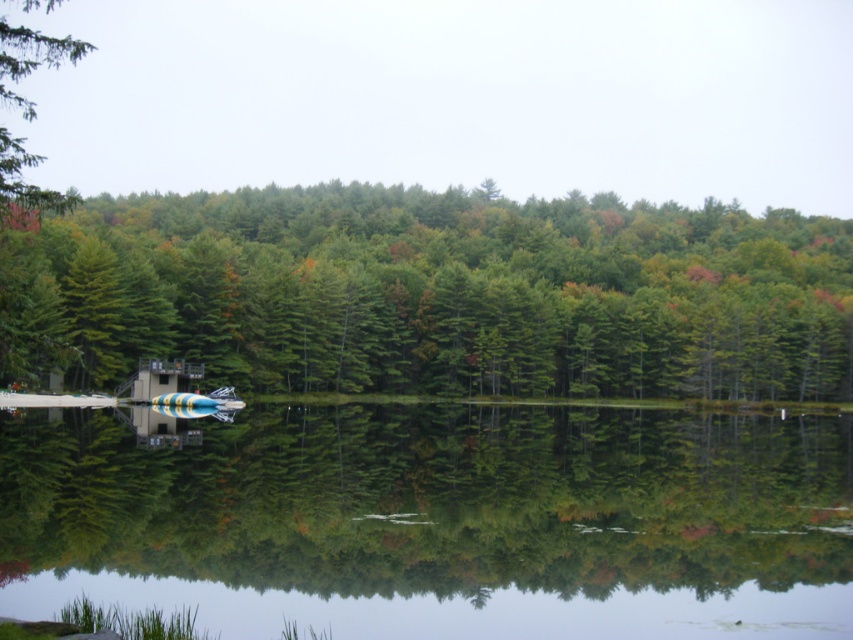
Question: Does clear water at center appear on the left side of green matte tree at upper left?

Choices:
 (A) yes
 (B) no

Answer: (B)

Question: Considering the relative positions of clear water at center and green matte tree at upper left in the image provided, where is clear water at center located with respect to green matte tree at upper left?

Choices:
 (A) above
 (B) below

Answer: (B)

Question: Among these objects, which one is farthest from the camera?

Choices:
 (A) green matte tree at upper left
 (B) clear water at center
 (C) green matte tree at center

Answer: (B)

Question: Is clear water at center above green matte tree at upper left?

Choices:
 (A) yes
 (B) no

Answer: (B)

Question: Among these objects, which one is farthest from the camera?

Choices:
 (A) green matte tree at upper left
 (B) green matte tree at center
 (C) clear water at center

Answer: (C)

Question: Which object is closer to the camera taking this photo?

Choices:
 (A) clear water at center
 (B) green matte tree at upper left
 (C) green matte tree at center

Answer: (C)